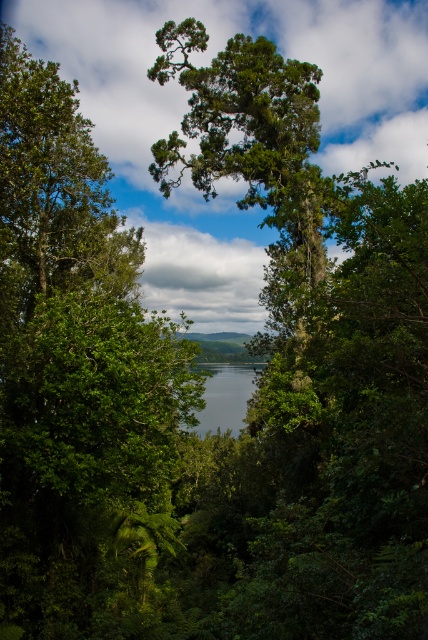
Which is below, green matte tree at center or clear water at center?

Positioned lower is clear water at center.

Is point (269, 129) farther from viewer compared to point (211, 404)?

No, it is in front of (211, 404).

Locate an element on the screen. The width and height of the screenshot is (428, 640). green matte tree at center is located at coordinates (250, 141).